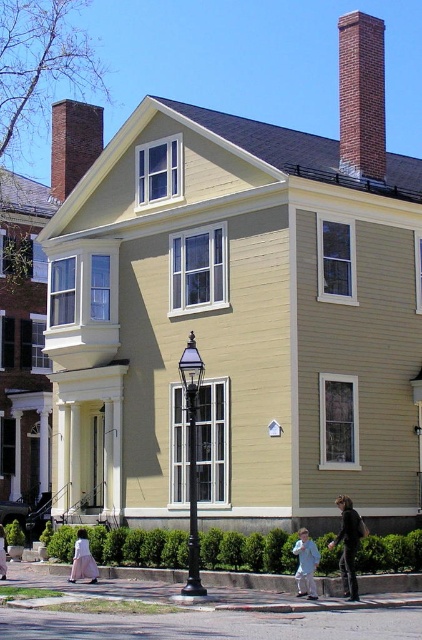
Question: Which point is farther to the camera?

Choices:
 (A) (362, 524)
 (B) (373, 84)
 (C) (205, 589)
 (D) (86, 561)

Answer: (B)

Question: Does black wrought iron streetlight at center have a lesser width compared to light pink fabric skirt at lower center?

Choices:
 (A) yes
 (B) no

Answer: (B)

Question: Is brick chimney at upper center closer to the viewer compared to light pink fabric skirt at lower center?

Choices:
 (A) yes
 (B) no

Answer: (B)

Question: Is brick chimney at upper right behind light blue fabric child at lower center?

Choices:
 (A) no
 (B) yes

Answer: (B)

Question: Which object is the farthest from the light blue fabric child at lower center?

Choices:
 (A) brick chimney at upper right
 (B) black wrought iron streetlight at center

Answer: (A)

Question: Among these points, which one is nearest to the camera?

Choices:
 (A) (191, 576)
 (B) (384, 84)
 (C) (59, 116)
 (D) (343, 532)

Answer: (A)